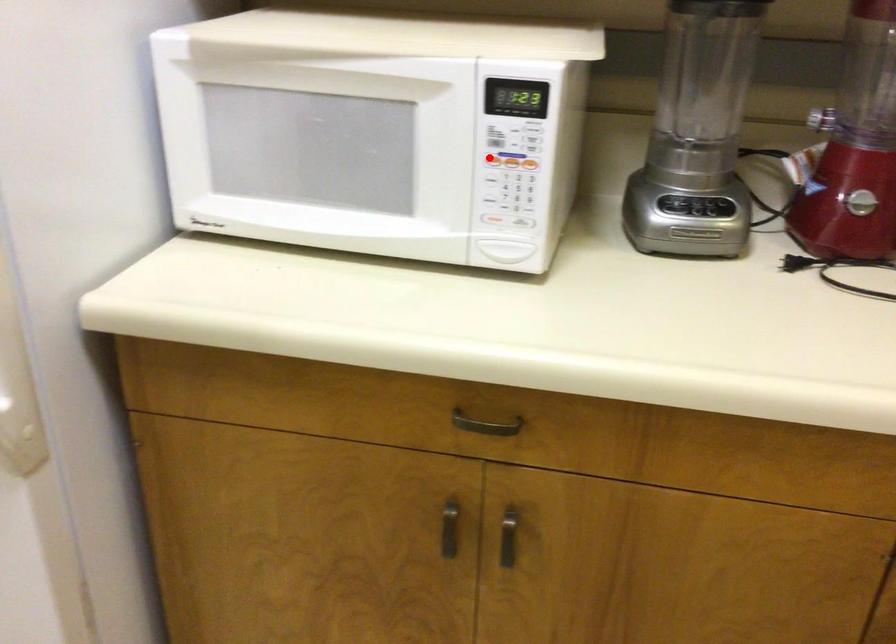
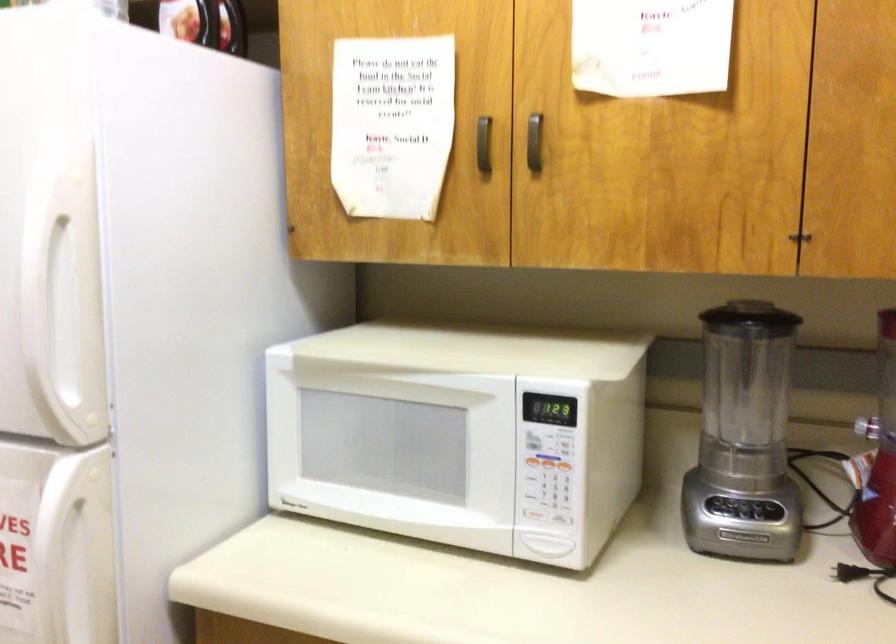
Where in the second image is the point corresponding to the highlighted location from the first image?

(530, 462)